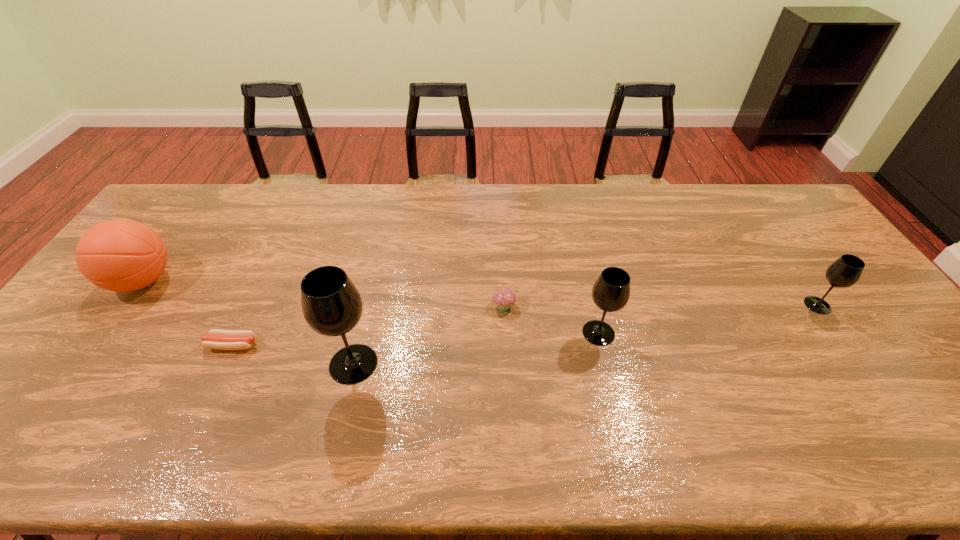
In the image, there is a desktop. Where is `free space at the far edge`? The height and width of the screenshot is (540, 960). free space at the far edge is located at coordinates (571, 204).

This screenshot has width=960, height=540. In the image, there is a desktop. What are the coordinates of `blank space at the near edge` in the screenshot? It's located at (289, 396).

The height and width of the screenshot is (540, 960). Find the location of `vacant space at the left edge of the desktop`. vacant space at the left edge of the desktop is located at coordinates (163, 232).

Where is `free space at the far left corner`? free space at the far left corner is located at coordinates 206,183.

In order to click on vacant area at the near left corner in this screenshot , I will do `click(7, 404)`.

Find the location of a particular element. The height and width of the screenshot is (540, 960). free spot at the near right corner of the desktop is located at coordinates (908, 395).

Where is `free area in between the cupcake and the rightmost object`? The image size is (960, 540). free area in between the cupcake and the rightmost object is located at coordinates 660,305.

Where is `free area in between the fifth tallest object and the fifth object from right to left`? This screenshot has width=960, height=540. free area in between the fifth tallest object and the fifth object from right to left is located at coordinates (369, 325).

Identify the location of unoccupied area between the second wineglass from right to left and the second object from left to right. (416, 339).

The image size is (960, 540). What are the coordinates of `free point between the fourth object from right to left and the sausage` in the screenshot? It's located at (293, 354).